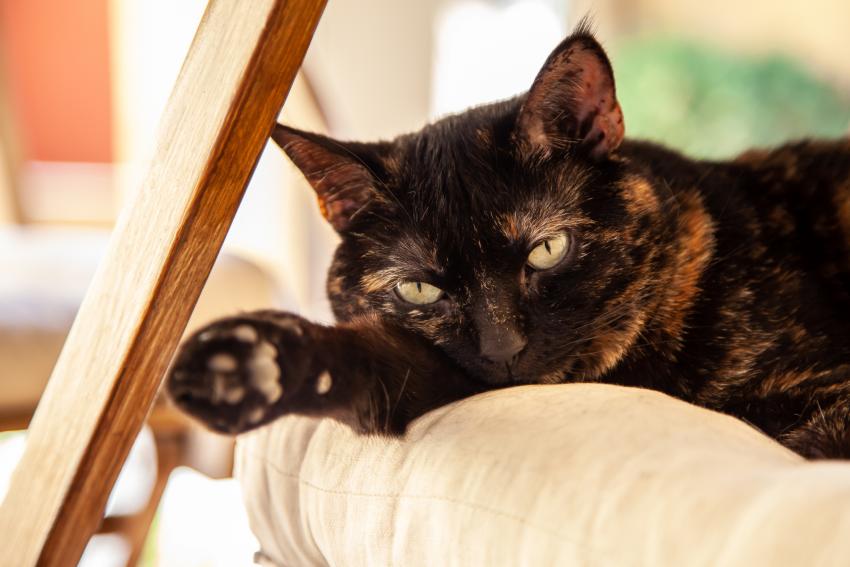
Locate an element on the screen. This screenshot has width=850, height=567. cushion is located at coordinates (575, 477).